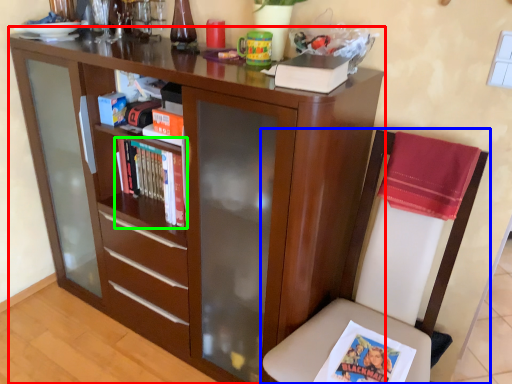
Question: Based on their relative distances, which object is nearer to bookcase (highlighted by a red box)? Choose from chair (highlighted by a blue box) and book (highlighted by a green box).

Choices:
 (A) chair
 (B) book

Answer: (B)